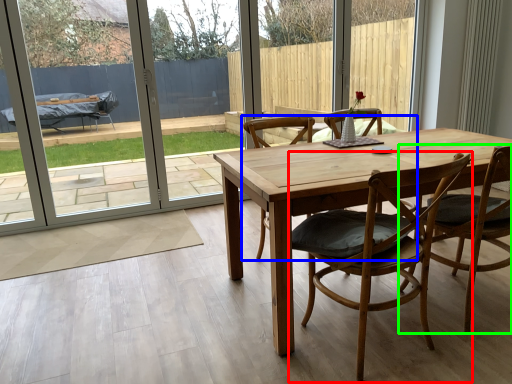
Question: Considering the real-world distances, which object is farthest from chair (highlighted by a red box)? chair (highlighted by a blue box) or chair (highlighted by a green box)?

Choices:
 (A) chair
 (B) chair

Answer: (A)